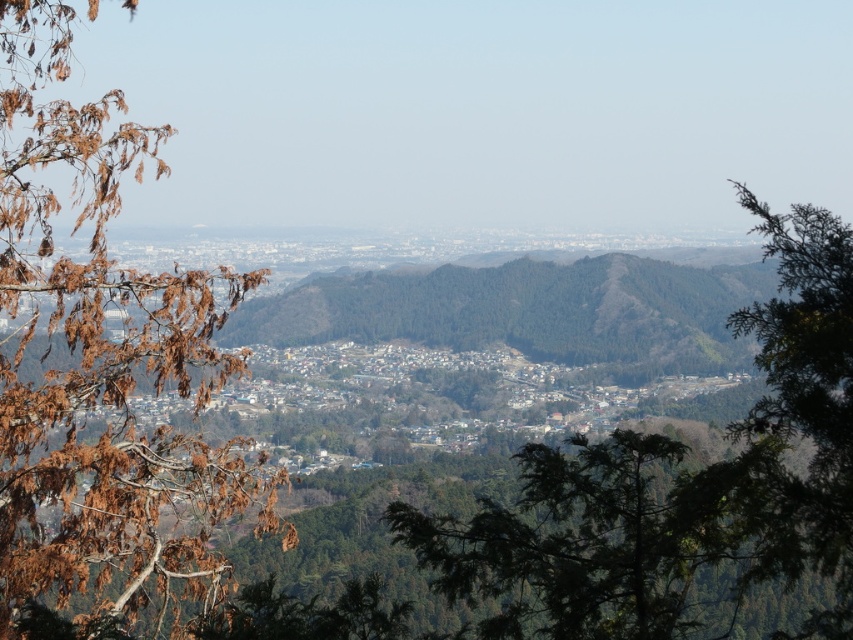
You are a hiker standing in the forest area. You notice brown dried leaves at left and a green leafy tree at right. Which object is positioned higher in the image?

The brown dried leaves at left are located above the green leafy tree at right, so they are positioned higher in the image.